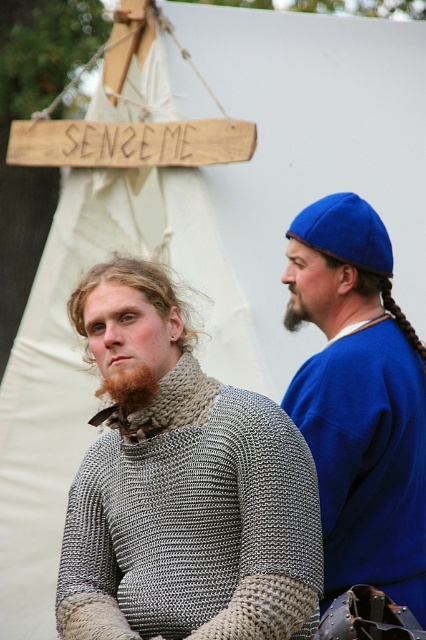
From the picture: Can you confirm if reddish-brown hair at left is positioned above brownwoollybeard at right?

No.

Find the location of a particular element. reddish-brown hair at left is located at coordinates (129, 387).

Who is more distant from viewer, [152,380] or [287,312]?

The point [287,312] is behind.

This screenshot has height=640, width=426. What are the coordinates of `reddish-brown hair at left` in the screenshot? It's located at (129, 387).

Between matte blue cap at upper right and brownwoollybeard at right, which one appears on the left side from the viewer's perspective?

brownwoollybeard at right is more to the left.

Who is higher up, matte blue cap at upper right or brownwoollybeard at right?

brownwoollybeard at right is above.

Is point (347, 522) in front of point (299, 292)?

Yes, it is.

Identify the location of matte blue cap at upper right. The width and height of the screenshot is (426, 640). (360, 403).

Who is higher up, chainmail at center or blue braided hair at right?

Positioned higher is blue braided hair at right.

Can you confirm if chainmail at center is taller than blue braided hair at right?

Correct, chainmail at center is much taller as blue braided hair at right.

The image size is (426, 640). I want to click on chainmail at center, so click(x=183, y=490).

Identify the location of chainmail at center. (183, 490).